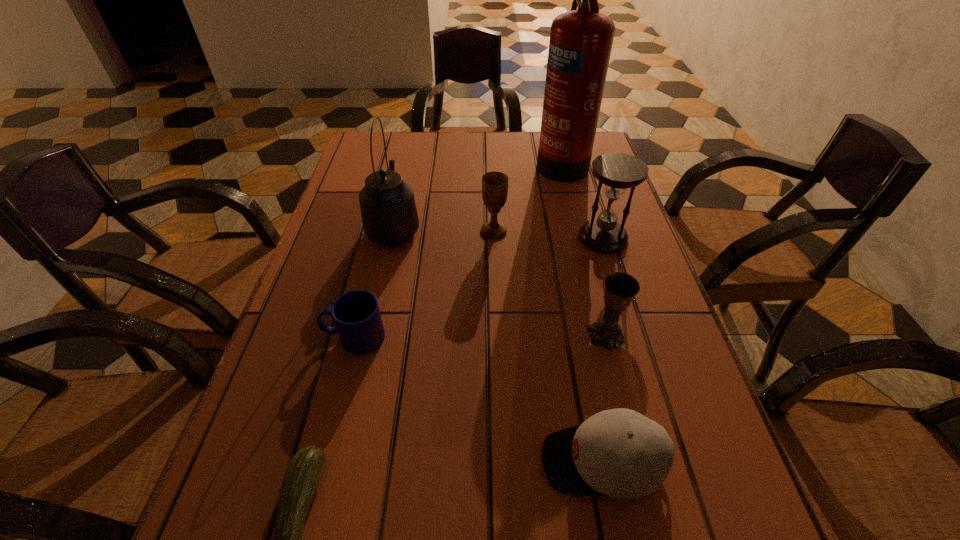
What are the coordinates of `object that ranks as the sixth closest to the hourglass` in the screenshot? It's located at (356, 314).

Select which object is the fifth closest to the farther chalice. Please provide its 2D coordinates. Your answer should be formatted as a tuple, i.e. [(x, y)], where the tuple contains the x and y coordinates of a point satisfying the conditions above.

[(356, 314)]